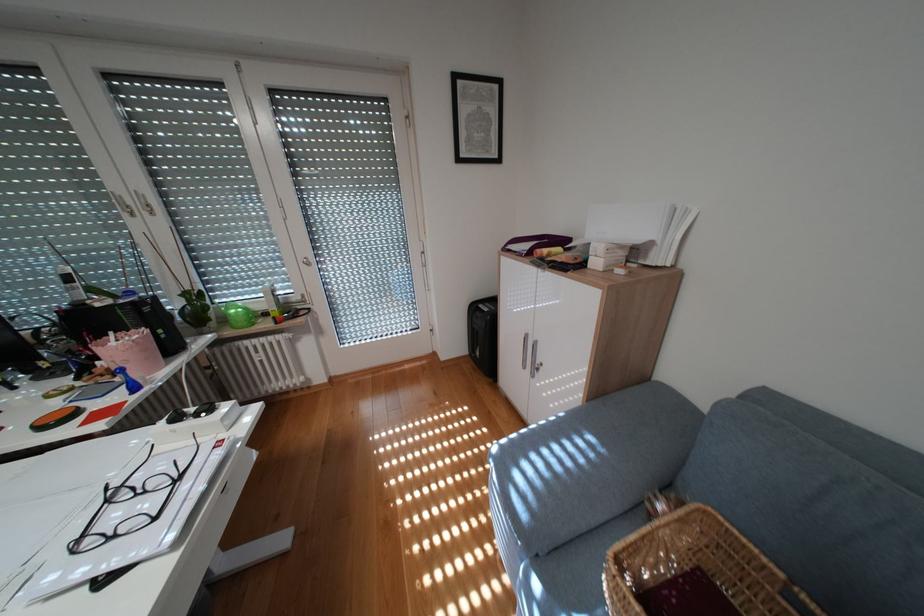
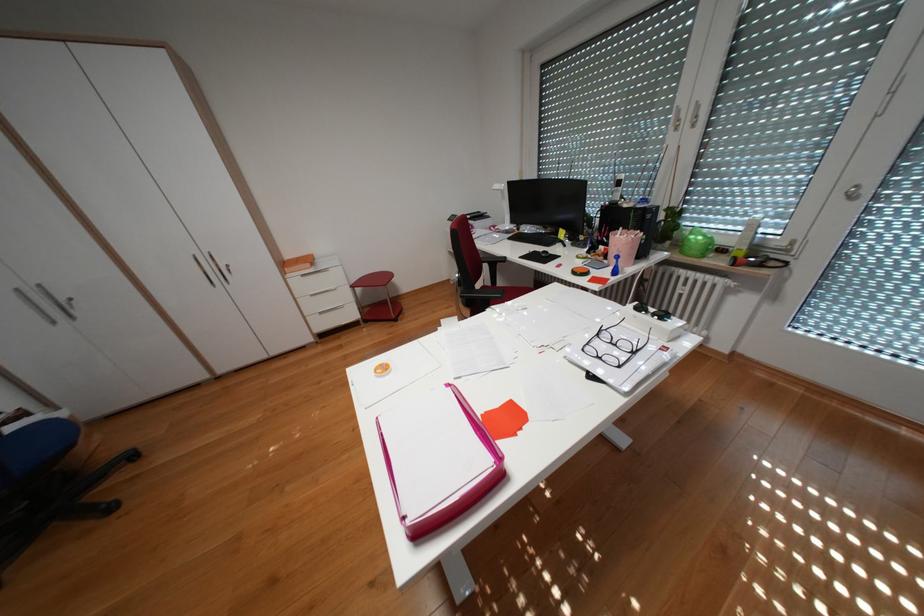
In the second image, find the point that corresponds to (x=141, y=201) in the first image.

(695, 116)